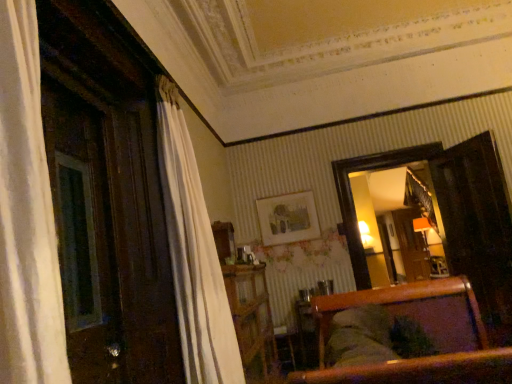
Question: Considering the relative positions of matte wooden picture frame at center and wooden armchair at center in the image provided, is matte wooden picture frame at center to the right of wooden armchair at center from the viewer's perspective?

Choices:
 (A) yes
 (B) no

Answer: (B)

Question: From a real-world perspective, is matte wooden picture frame at center positioned under wooden armchair at center based on gravity?

Choices:
 (A) yes
 (B) no

Answer: (B)

Question: Is matte wooden picture frame at center positioned behind wooden armchair at center?

Choices:
 (A) yes
 (B) no

Answer: (A)

Question: Is matte wooden picture frame at center not near wooden armchair at center?

Choices:
 (A) no
 (B) yes

Answer: (B)

Question: Is wooden armchair at center at the back of matte wooden picture frame at center?

Choices:
 (A) no
 (B) yes

Answer: (A)

Question: In the image, is wooden dresser at center positioned in front of or behind wooden armchair at center?

Choices:
 (A) front
 (B) behind

Answer: (B)

Question: From their relative heights in the image, would you say wooden dresser at center is taller or shorter than wooden armchair at center?

Choices:
 (A) tall
 (B) short

Answer: (A)

Question: From a real-world perspective, is wooden dresser at center above or below wooden armchair at center?

Choices:
 (A) above
 (B) below

Answer: (B)

Question: Do you think wooden dresser at center is within wooden armchair at center, or outside of it?

Choices:
 (A) outside
 (B) inside

Answer: (A)

Question: Is wooden dresser at center spatially inside matte wooden picture frame at center, or outside of it?

Choices:
 (A) inside
 (B) outside

Answer: (B)

Question: From the image's perspective, is wooden dresser at center positioned above or below matte wooden picture frame at center?

Choices:
 (A) below
 (B) above

Answer: (A)

Question: Relative to matte wooden picture frame at center, is wooden dresser at center in front or behind?

Choices:
 (A) behind
 (B) front

Answer: (B)

Question: Does point (239, 264) appear closer or farther from the camera than point (265, 221)?

Choices:
 (A) farther
 (B) closer

Answer: (B)

Question: From the image's perspective, is wooden armchair at center above or below wooden dresser at center?

Choices:
 (A) below
 (B) above

Answer: (B)

Question: Looking at their shapes, would you say wooden armchair at center is wider or thinner than wooden dresser at center?

Choices:
 (A) wide
 (B) thin

Answer: (A)